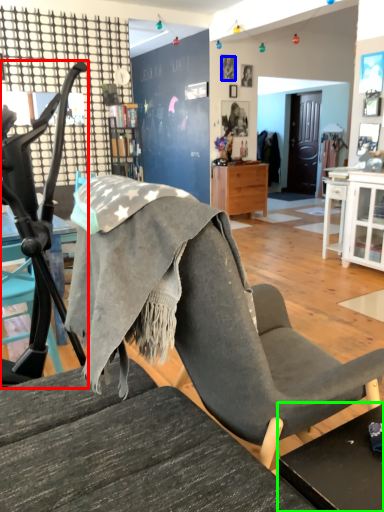
Question: Considering the real-world distances, which object is closest to chair (highlighted by a red box)? person (highlighted by a blue box) or table (highlighted by a green box).

Choices:
 (A) person
 (B) table

Answer: (B)